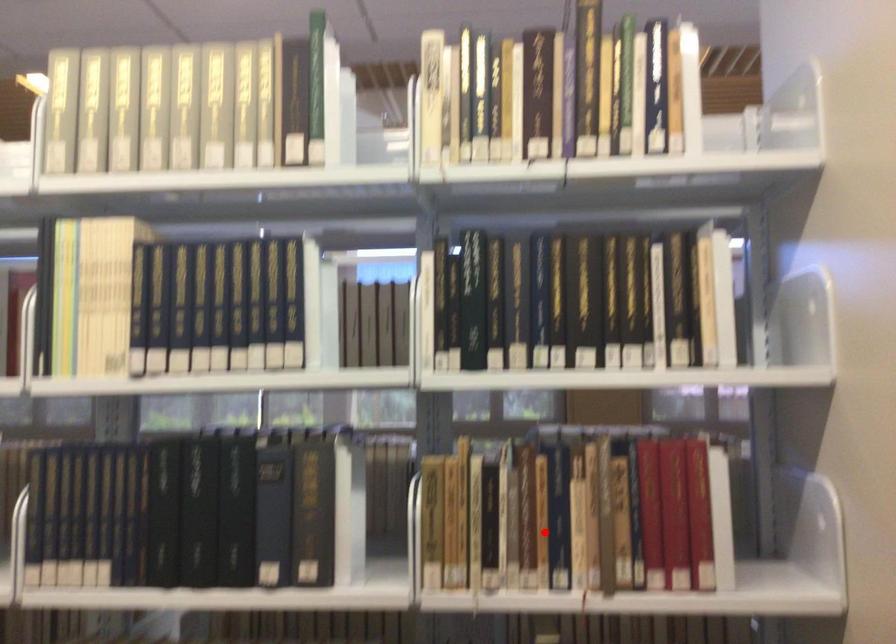
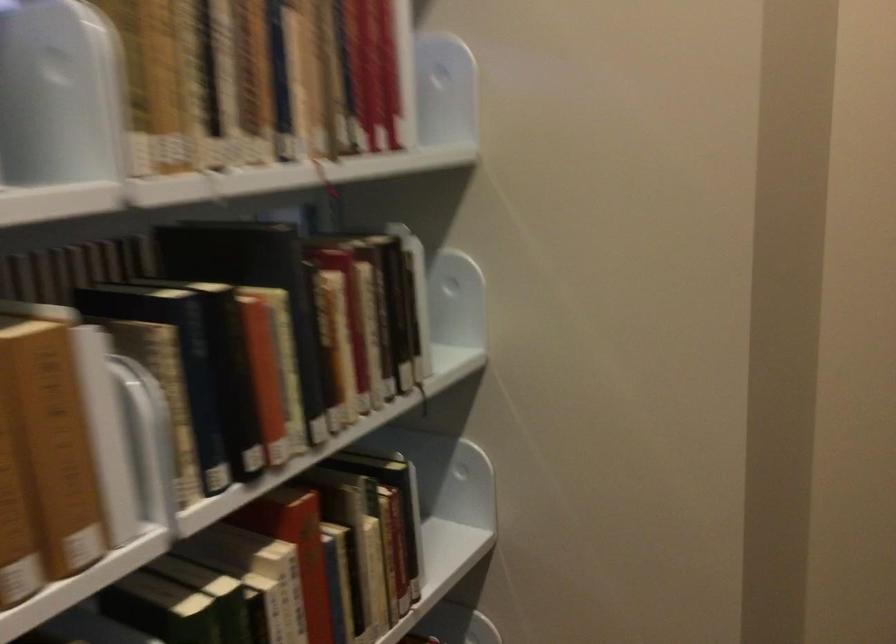
Question: A red point is marked in image1. In image2, is the corresponding 3D point closer to the camera or farther? Reply with the corresponding letter.

Choices:
 (A) The corresponding 3D point is closer.
 (B) The corresponding 3D point is farther.

Answer: (A)